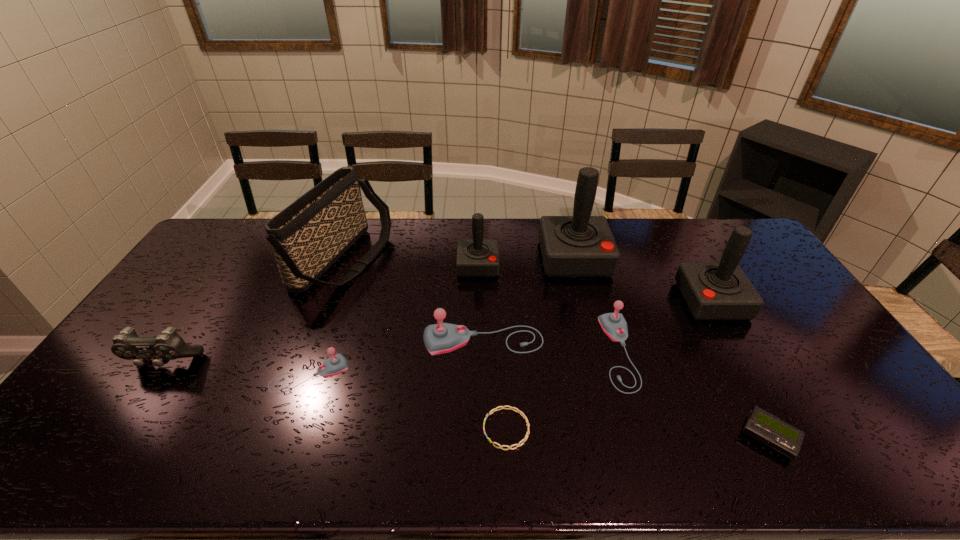
This screenshot has width=960, height=540. In order to click on free space located 0.170m on the surface of the blue bracelet showing star-shaped elements in this screenshot , I will do coord(414,429).

Find the location of a particular element. The width and height of the screenshot is (960, 540). handbag at the far edge is located at coordinates (307, 237).

Where is `beeper that is at the near edge`? beeper that is at the near edge is located at coordinates (766, 428).

Locate an element on the screen. This screenshot has height=540, width=960. bracelet at the near edge is located at coordinates (502, 407).

Identify the location of object that is positioned at the left edge. (127, 345).

You are a GUI agent. You are given a task and a screenshot of the screen. Output one action in this format:
    pyautogui.click(x=<x>, y=<y>)
    Task: Click on the free space at the far edge of the desktop
    The width and height of the screenshot is (960, 540).
    Given the screenshot: What is the action you would take?
    pyautogui.click(x=646, y=237)

Identify the location of vacant area at the left edge. This screenshot has height=540, width=960. (183, 309).

You are a GUI agent. You are given a task and a screenshot of the screen. Output one action in this format:
    pyautogui.click(x=<x>, y=<y>)
    Task: Click on the vacant space at the right edge
    The width and height of the screenshot is (960, 540).
    Given the screenshot: What is the action you would take?
    pyautogui.click(x=784, y=342)

Find the location of a particular element. vacant space at the far left corner is located at coordinates (231, 241).

The height and width of the screenshot is (540, 960). I want to click on free region at the far right corner of the desktop, so click(x=757, y=251).